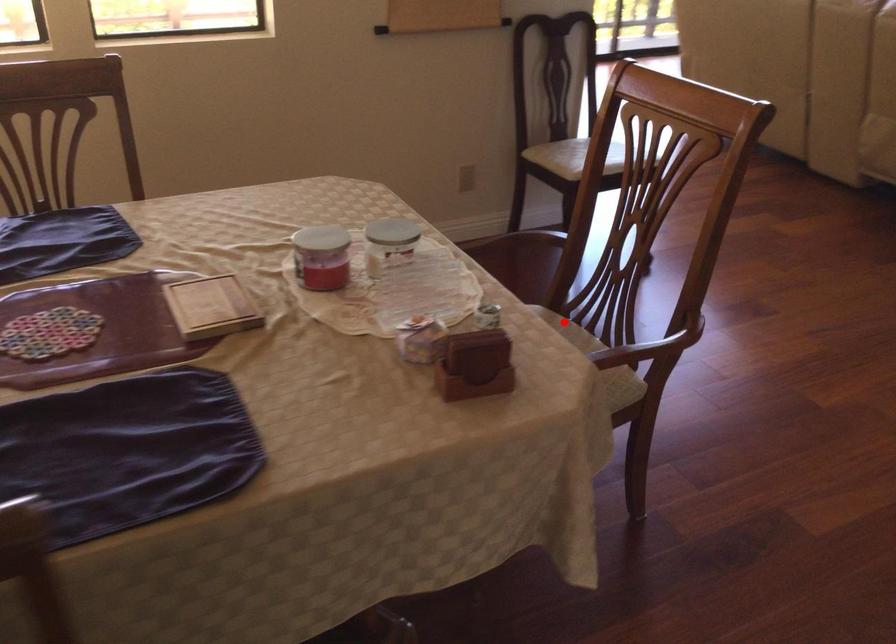
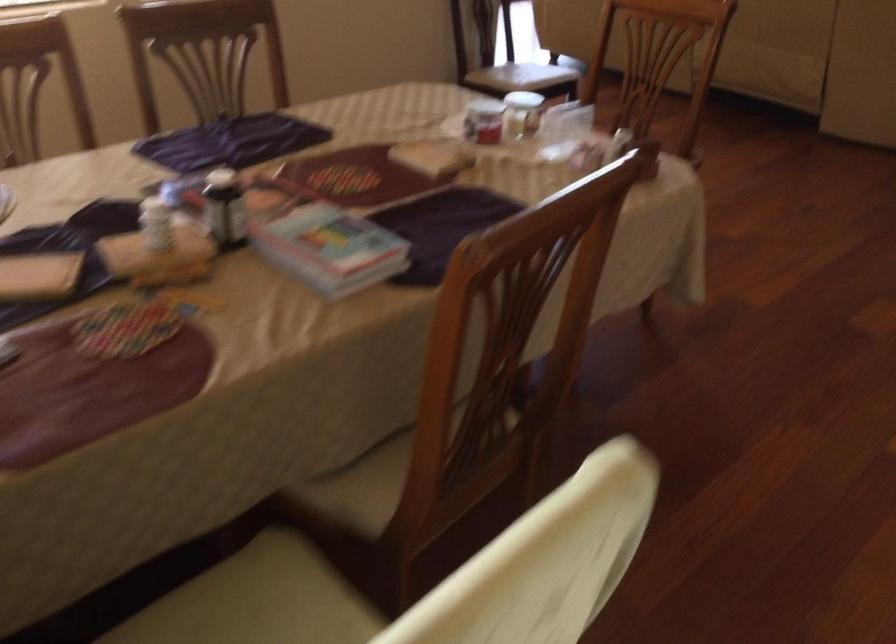
Question: I am providing you with two images of the same scene from different viewpoints. A red point is marked on the first image. Can you still see the location of the red point in image 2?

Choices:
 (A) Yes
 (B) No

Answer: (B)